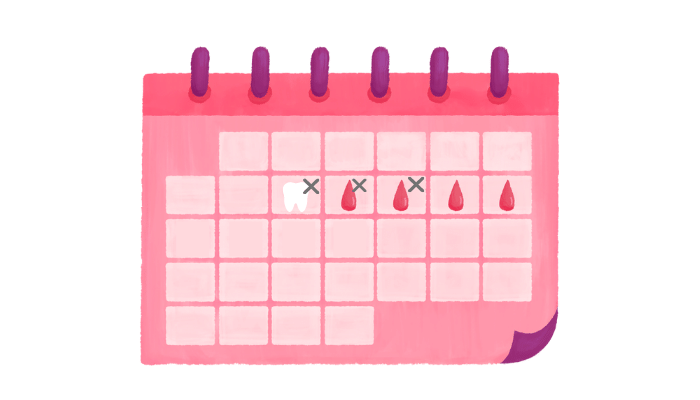
Find the location of `binder rings`. binder rings is located at coordinates (203, 59), (255, 75), (320, 77), (383, 61), (437, 68), (505, 64).